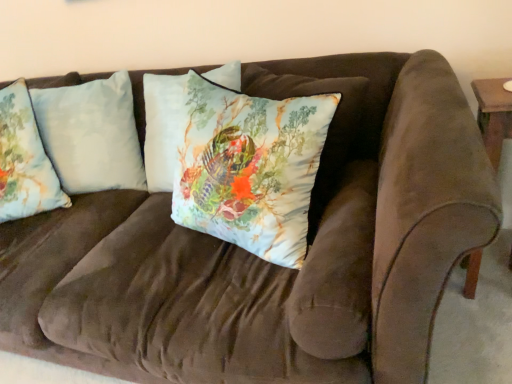
Question: Considering the positions of light blue fabric pillow at left, the first pillow from the left, and light blue fabric pillow at left, which ranks as the second pillow in right-to-left order, in the image, is light blue fabric pillow at left, the first pillow from the left, taller or shorter than light blue fabric pillow at left, which ranks as the second pillow in right-to-left order,?

Choices:
 (A) short
 (B) tall

Answer: (A)

Question: Is light blue fabric pillow at left, the first pillow from the left, in front of or behind light blue fabric pillow at left, which ranks as the second pillow in right-to-left order, in the image?

Choices:
 (A) behind
 (B) front

Answer: (B)

Question: Based on their relative distances, which object is nearer to the silky floral pillow at center, marked as the third pillow in a left-to-right arrangement?

Choices:
 (A) light blue fabric pillow at left, which appears as the second pillow when viewed from the left
 (B) light blue fabric pillow at left, the first pillow from the left

Answer: (A)

Question: Estimate the real-world distances between objects in this image. Which object is closer to the light blue fabric pillow at left, the first pillow from the left?

Choices:
 (A) light blue fabric pillow at left, which appears as the second pillow when viewed from the left
 (B) silky floral pillow at center, positioned as the first pillow in right-to-left order

Answer: (A)